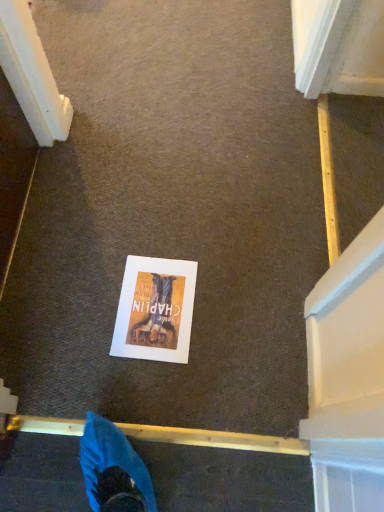
This screenshot has height=512, width=384. In order to click on vacant area to the right of white paper at center in this screenshot , I will do `click(233, 316)`.